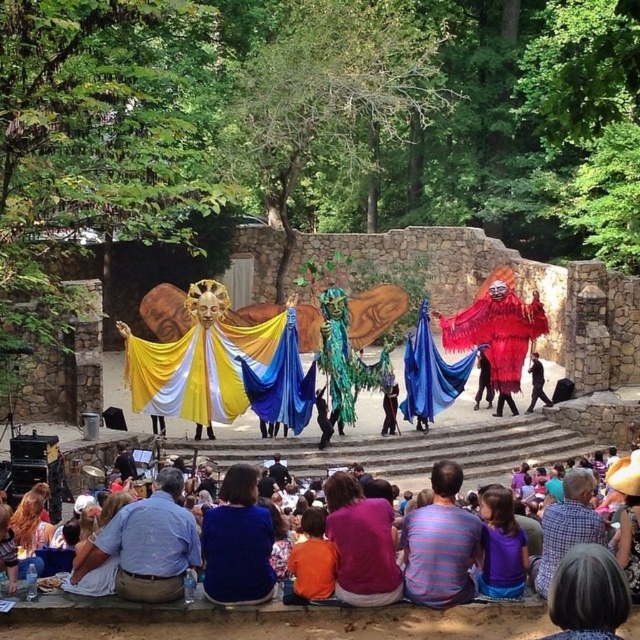
Question: Is denim jacket at lower left positioned behind blue fabric at center?

Choices:
 (A) yes
 (B) no

Answer: (B)

Question: Which point appears closest to the camera in this image?

Choices:
 (A) (445, 604)
 (B) (80, 605)
 (C) (611, 624)
 (D) (589, 516)

Answer: (C)

Question: Which point is farther from the camera taking this photo?

Choices:
 (A) (611, 596)
 (B) (554, 556)
 (C) (349, 572)

Answer: (B)

Question: Is orange cotton shirt at center smaller than black fabric jacket at center?

Choices:
 (A) yes
 (B) no

Answer: (B)

Question: Can you confirm if yellow satin cape at center is thinner than blue fabric at center?

Choices:
 (A) no
 (B) yes

Answer: (A)

Question: Which of these objects is positioned closest to the yellow satin cape at center?

Choices:
 (A) short dark hair at lower right
 (B) black fabric jacket at center

Answer: (B)